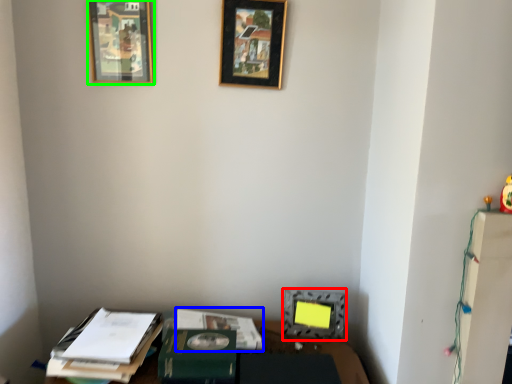
Question: Which object is positioned farthest from picture frame (highlighted by a red box)? Select from journal (highlighted by a blue box) and picture frame (highlighted by a green box).

Choices:
 (A) journal
 (B) picture frame

Answer: (B)